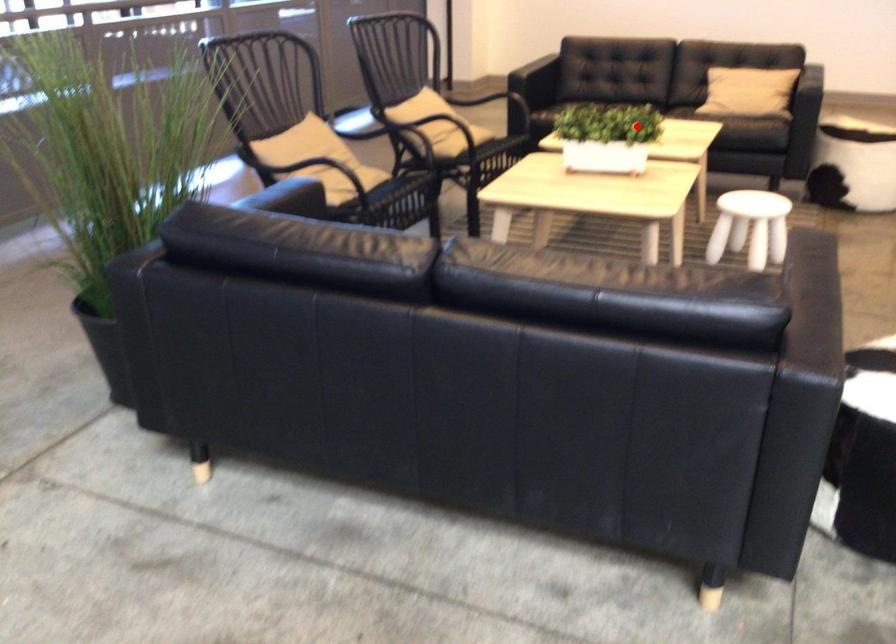
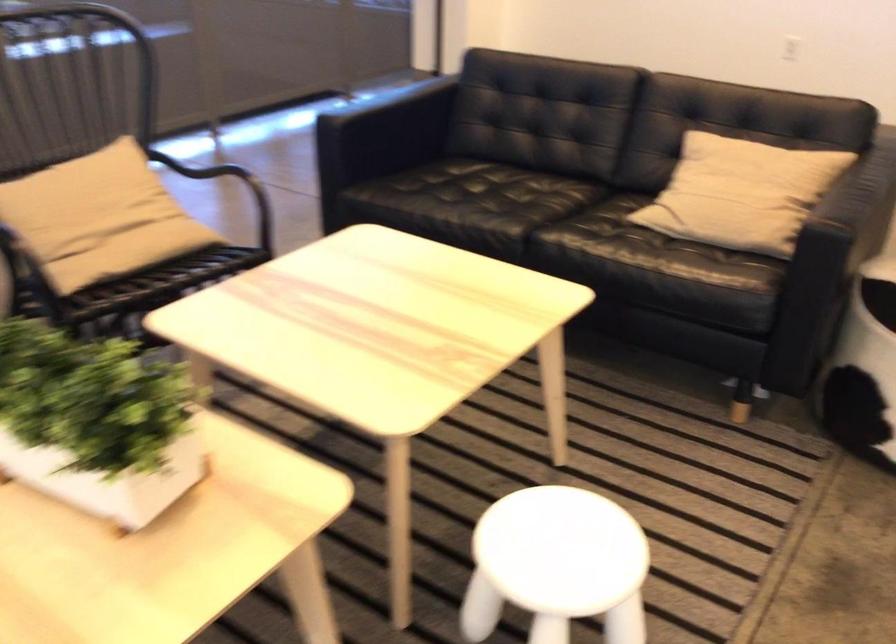
Question: I am providing you with two images of the same scene from different viewpoints. A red point is shown in image1. For the corresponding object point in image2, is it positioned nearer or farther from the camera?

Choices:
 (A) Nearer
 (B) Farther

Answer: (A)